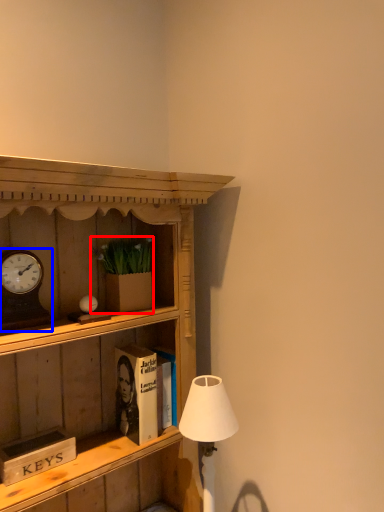
Question: Which point is closer to the camera, houseplant (highlighted by a red box) or clock (highlighted by a blue box)?

Choices:
 (A) houseplant
 (B) clock

Answer: (B)